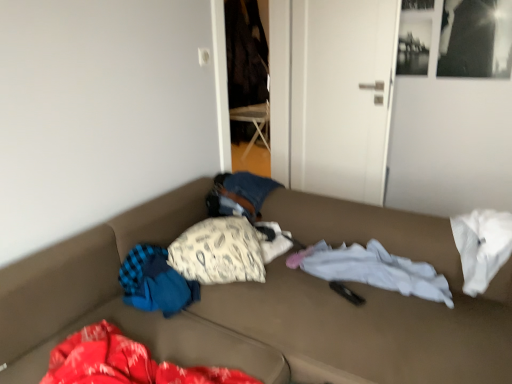
Question: Would you say white fabric pillow at center is to the left or to the right of white matte door at center in the picture?

Choices:
 (A) right
 (B) left

Answer: (B)

Question: From a real-world perspective, is white fabric pillow at center physically located above or below white matte door at center?

Choices:
 (A) above
 (B) below

Answer: (B)

Question: Which object is the farthest from the white fabric pillow at center?

Choices:
 (A) brown fabric couch at center
 (B) white soft fabric at center
 (C) white matte door at center

Answer: (C)

Question: Considering the real-world distances, which object is farthest from the brown fabric couch at center?

Choices:
 (A) white fabric pillow at center
 (B) white matte door at center
 (C) white soft fabric at center

Answer: (B)